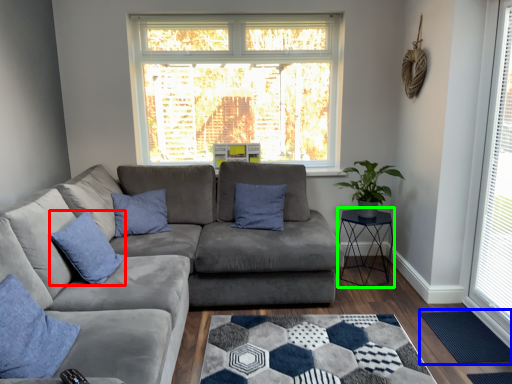
Question: Considering the real-world distances, which object is farthest from pillow (highlighted by a red box)? mat (highlighted by a blue box) or cocktail table (highlighted by a green box)?

Choices:
 (A) mat
 (B) cocktail table

Answer: (A)